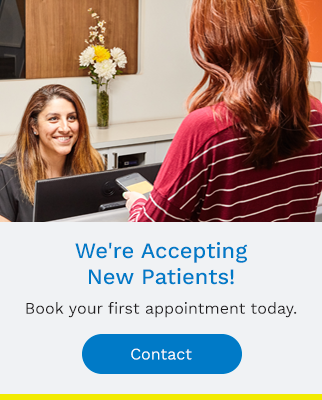
In order to click on monitor in this screenshot , I will do `click(72, 192)`.